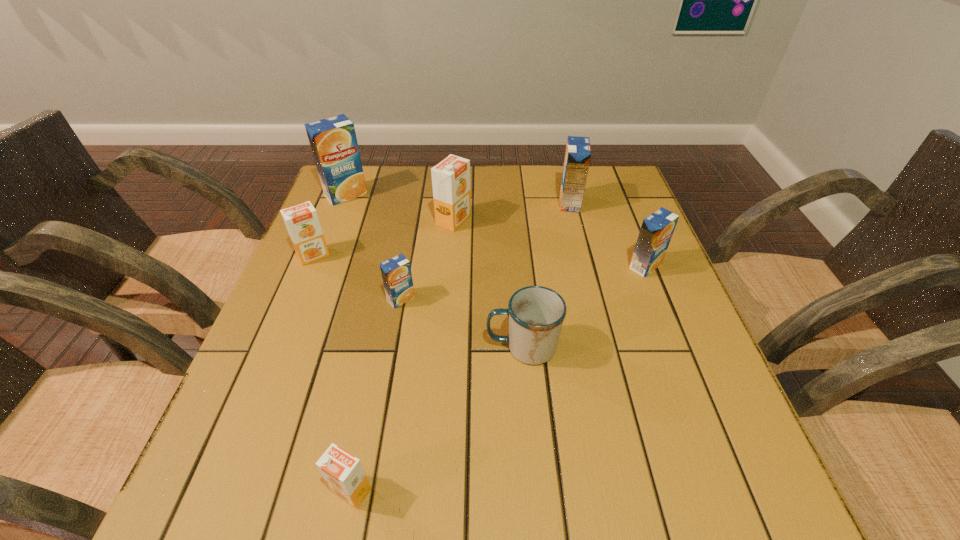
Where is `vacant area that lies between the nearest orange orange juice and the farthest orange orange juice`? The height and width of the screenshot is (540, 960). vacant area that lies between the nearest orange orange juice and the farthest orange orange juice is located at coordinates (402, 355).

You are a GUI agent. You are given a task and a screenshot of the screen. Output one action in this format:
    pyautogui.click(x=<x>, y=<y>)
    Task: Click on the free space between the white mug and the leftmost blue orange_juice
    The width and height of the screenshot is (960, 540).
    Given the screenshot: What is the action you would take?
    pyautogui.click(x=434, y=271)

Where is `vacant point located between the nearest orange orange juice and the rightmost object`? vacant point located between the nearest orange orange juice and the rightmost object is located at coordinates (498, 378).

Identify the location of vacant point located between the third nearest object and the fifth orange juice from left to right. This screenshot has width=960, height=540. (427, 259).

Find the location of a particular element. This screenshot has width=960, height=540. free space between the leftmost blue orange_juice and the mug is located at coordinates (434, 271).

Locate an element on the screen. The width and height of the screenshot is (960, 540). empty space that is in between the third object from right to left and the nearest orange juice is located at coordinates (437, 418).

Select which object is the second closest to the sixth object from left to right. Please provide its 2D coordinates. Your answer should be formatted as a tuple, i.e. [(x, y)], where the tuple contains the x and y coordinates of a point satisfying the conditions above.

[(657, 229)]

Choose which object is the fifth nearest neighbor to the second nearest object. Please provide its 2D coordinates. Your answer should be formatted as a tuple, i.e. [(x, y)], where the tuple contains the x and y coordinates of a point satisfying the conditions above.

[(578, 151)]

This screenshot has height=540, width=960. Identify the location of orange juice that is the fifth nearest to the second nearest object. (578, 151).

You are a GUI agent. You are given a task and a screenshot of the screen. Output one action in this format:
    pyautogui.click(x=<x>, y=<y>)
    Task: Click on the closest orange juice to the second smallest orange orange juice
    This screenshot has width=960, height=540.
    Given the screenshot: What is the action you would take?
    pyautogui.click(x=333, y=141)